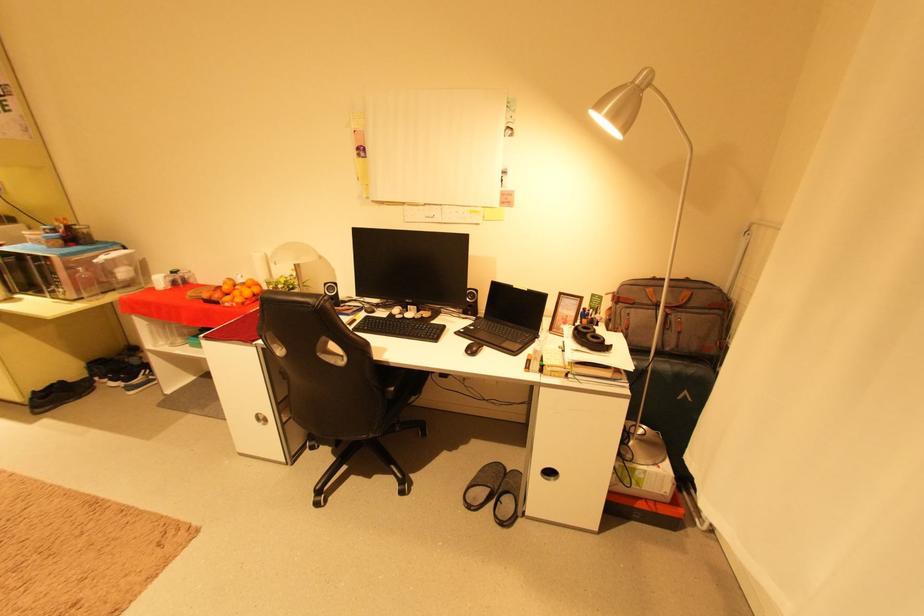
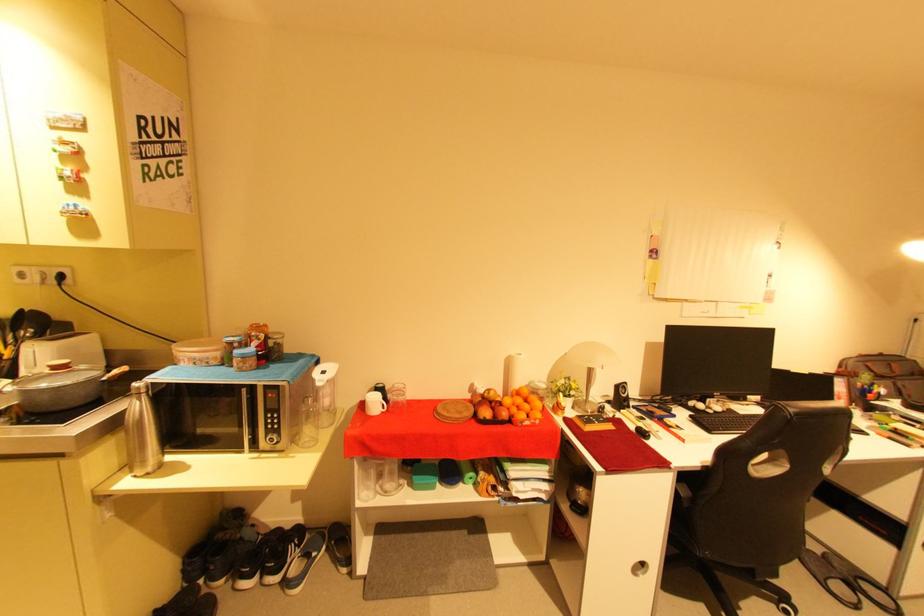
Question: What movement of the cameraman would produce the second image?

Choices:
 (A) Left
 (B) Right
 (C) Forward
 (D) Backward

Answer: (A)